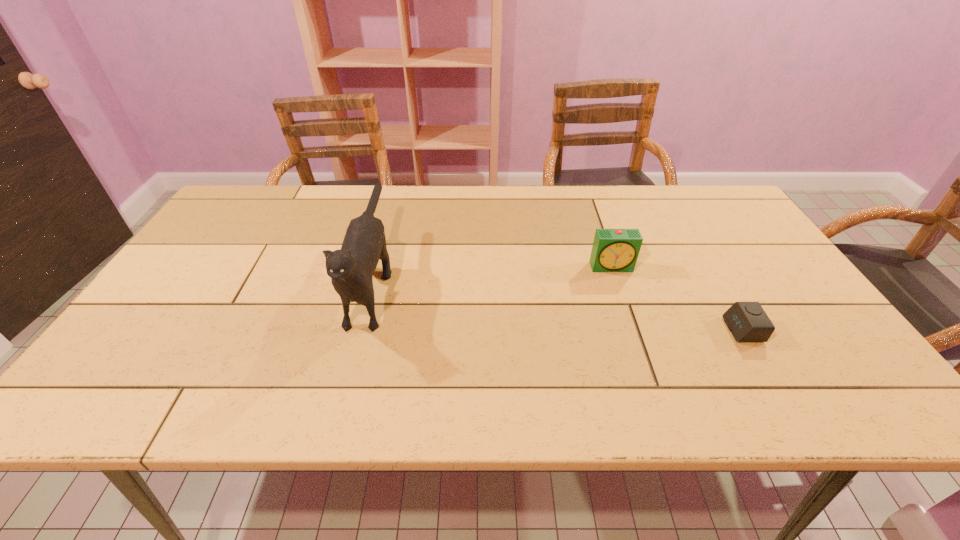
This screenshot has height=540, width=960. What are the coordinates of `the tallest object` in the screenshot? It's located at 351,269.

In order to click on the leftmost object in this screenshot , I will do `click(351, 269)`.

Where is `the left alarm clock`? the left alarm clock is located at coordinates (614, 250).

Image resolution: width=960 pixels, height=540 pixels. In order to click on the farther alarm clock in this screenshot , I will do `click(614, 250)`.

Locate an element on the screen. the shorter alarm clock is located at coordinates (747, 321).

Find the location of `the nearer alarm clock`. the nearer alarm clock is located at coordinates (747, 321).

I want to click on vacant space located 0.090m on the front-facing side of the tallest object, so [x=346, y=382].

Where is `free spot located on the front-facing side of the second tallest object`? This screenshot has width=960, height=540. free spot located on the front-facing side of the second tallest object is located at coordinates (635, 333).

Find the location of a particular element. vacant space positioned on the front-facing side of the shorter alarm clock is located at coordinates (668, 330).

Where is `vacant space located 0.070m on the front-facing side of the shorter alarm clock`? vacant space located 0.070m on the front-facing side of the shorter alarm clock is located at coordinates (698, 330).